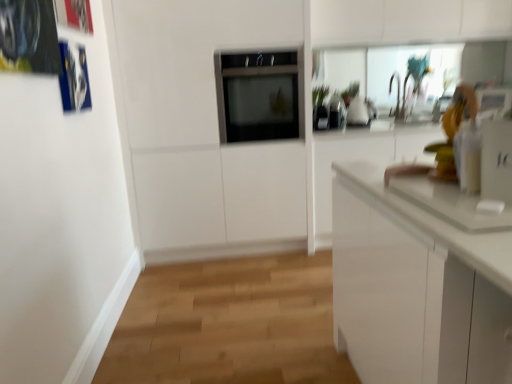
Identify the location of satin black oven at center. Image resolution: width=512 pixels, height=384 pixels. (259, 95).

The width and height of the screenshot is (512, 384). Describe the element at coordinates (259, 95) in the screenshot. I see `satin black oven at center` at that location.

Identify the location of white glossy soap dispenser at right. Image resolution: width=512 pixels, height=384 pixels. (496, 160).

This screenshot has width=512, height=384. Describe the element at coordinates (496, 160) in the screenshot. I see `white glossy soap dispenser at right` at that location.

Where is `satin black oven at center`? This screenshot has height=384, width=512. satin black oven at center is located at coordinates (259, 95).

In the image, is white glossy soap dispenser at right on the left side or the right side of satin black oven at center?

Clearly, white glossy soap dispenser at right is on the right of satin black oven at center in the image.

Which is behind, white glossy soap dispenser at right or satin black oven at center?

satin black oven at center is further away from the camera.

Does point (507, 132) come behind point (276, 66)?

That is False.

From the image's perspective, which is below, white glossy soap dispenser at right or satin black oven at center?

white glossy soap dispenser at right, from the image's perspective.

From a real-world perspective, which is physically below, white glossy soap dispenser at right or satin black oven at center?

In real-world perspective, white glossy soap dispenser at right is lower.

Between white glossy soap dispenser at right and satin black oven at center, which one has larger width?

satin black oven at center.

Consider the image. Between white glossy soap dispenser at right and satin black oven at center, which one has more height?

With more height is satin black oven at center.

Considering the sizes of white glossy soap dispenser at right and satin black oven at center in the image, is white glossy soap dispenser at right bigger or smaller than satin black oven at center?

white glossy soap dispenser at right is smaller than satin black oven at center.

In the scene shown: Is white glossy soap dispenser at right outside of satin black oven at center?

white glossy soap dispenser at right is positioned outside satin black oven at center.

Is white glossy soap dispenser at right in contact with satin black oven at center?

No, white glossy soap dispenser at right is not with satin black oven at center.

Is white glossy soap dispenser at right positioned with its back to satin black oven at center?

No, satin black oven at center is not at the back of white glossy soap dispenser at right.

The width and height of the screenshot is (512, 384). What are the coordinates of `oven that is above the white glossy soap dispenser at right (from the image's perspective)` in the screenshot? It's located at (259, 95).

Can you confirm if satin black oven at center is positioned to the right of white glossy soap dispenser at right?

In fact, satin black oven at center is to the left of white glossy soap dispenser at right.

Is satin black oven at center further to the viewer compared to white glossy soap dispenser at right?

Yes, satin black oven at center is behind white glossy soap dispenser at right.

Which point is more distant from viewer, (231, 126) or (510, 160)?

The point (231, 126) is behind.

From the image's perspective, is satin black oven at center under white glossy soap dispenser at right?

Incorrect, from the image's perspective, satin black oven at center is higher than white glossy soap dispenser at right.

From a real-world perspective, who is located higher, satin black oven at center or white glossy soap dispenser at right?

satin black oven at center is physically above.

From the picture: Is satin black oven at center wider than white glossy soap dispenser at right?

Yes.

Is satin black oven at center taller than white glossy soap dispenser at right?

Correct, satin black oven at center is much taller as white glossy soap dispenser at right.

Considering the relative sizes of satin black oven at center and white glossy soap dispenser at right in the image provided, is satin black oven at center bigger than white glossy soap dispenser at right?

Yes.

Consider the image. Would you say satin black oven at center contains white glossy soap dispenser at right?

No, white glossy soap dispenser at right is not surrounded by satin black oven at center.

Based on the photo, would you say satin black oven at center is a long distance from white glossy soap dispenser at right?

Absolutely, satin black oven at center is distant from white glossy soap dispenser at right.

Is satin black oven at center oriented towards white glossy soap dispenser at right?

Yes.

How different are the orientations of satin black oven at center and white glossy soap dispenser at right in degrees?

The angle between the facing direction of satin black oven at center and the facing direction of white glossy soap dispenser at right is 90.1 degrees.

From the picture: How much distance is there between satin black oven at center and white glossy soap dispenser at right?

satin black oven at center is 1.97 meters away from white glossy soap dispenser at right.

Locate an element on the screen. The width and height of the screenshot is (512, 384). appliance in front of the satin black oven at center is located at coordinates (496, 160).

This screenshot has height=384, width=512. Find the location of `oven located above the white glossy soap dispenser at right (from a real-world perspective)`. oven located above the white glossy soap dispenser at right (from a real-world perspective) is located at coordinates (259, 95).

Image resolution: width=512 pixels, height=384 pixels. I want to click on oven on the left side of white glossy soap dispenser at right, so click(x=259, y=95).